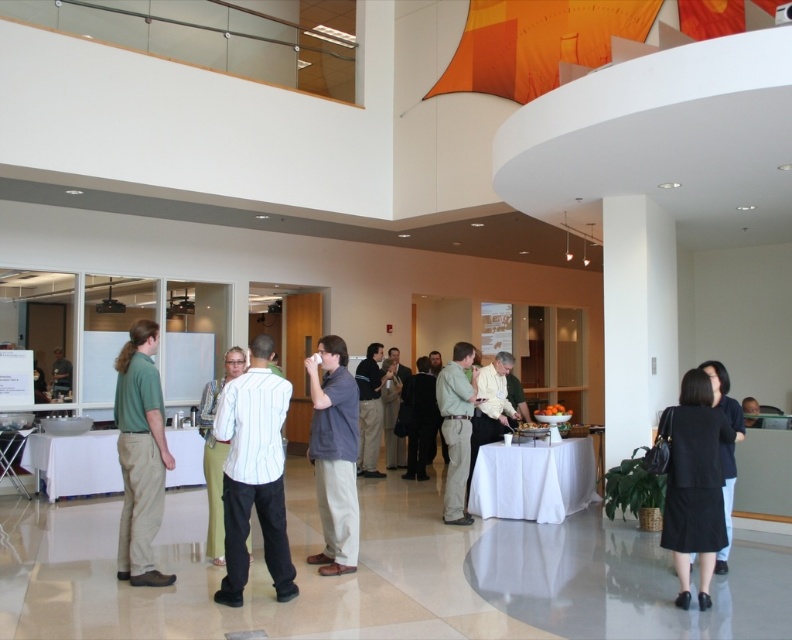
You are standing in the conference room and notice two items of clothing. The green cotton shirt at left and the light green pants at center. Which clothing item appears taller in the image?

The green cotton shirt at left appears taller than the light green pants at center in the image.

You are a photographer standing at the entrance of the conference room. You want to take a photo that includes both the white striped shirt at center and the dark brown leather jacket at center. Given that your camera has a maximum focus range of 5 meters, will you be able to capture both subjects in focus without moving closer?

The white striped shirt at center and dark brown leather jacket at center are 5.45 meters apart. Since the distance between them exceeds the camera maximum focus range of 5 meters, you won not be able to capture both subjects in focus without moving closer.

You are standing in the conference room and want to take a photo of both the point at location (257, 508) and the point at (406, 406). Which point should you focus on first to ensure both are in sharp focus?

You should focus on the point at (406, 406) first because it is farther from the camera than the point at (257, 508). By focusing on the farther point, the closer point will also be within the depth of field and in focus.